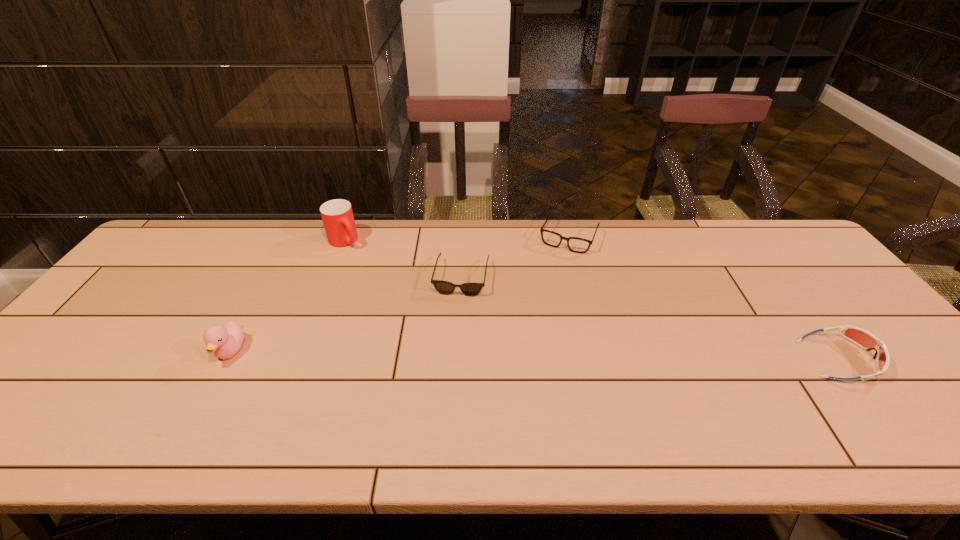
The height and width of the screenshot is (540, 960). I want to click on vacant space positioned 0.120m on the front-facing side of the spectacles, so click(x=549, y=276).

Where is `vacant space located 0.100m on the front-facing side of the spectacles`? This screenshot has width=960, height=540. vacant space located 0.100m on the front-facing side of the spectacles is located at coordinates (551, 272).

The width and height of the screenshot is (960, 540). Identify the location of vacant space located 0.360m on the front-facing side of the spectacles. (521, 332).

What are the coordinates of `vacant area located on the front lenses of the sunglasses` in the screenshot? It's located at (437, 406).

I want to click on free spot located 0.150m on the front lenses of the sunglasses, so click(x=450, y=337).

Locate an element on the screen. vacant position located on the front lenses of the sunglasses is located at coordinates (451, 328).

Where is `free space located 0.140m on the side of the tallest object with the handle`? The width and height of the screenshot is (960, 540). free space located 0.140m on the side of the tallest object with the handle is located at coordinates (373, 271).

What are the coordinates of `free space located on the side of the tallest object with the handle` in the screenshot? It's located at (408, 305).

At what (x,y) coordinates should I click in order to perform the action: click on vacant space located on the side of the tallest object with the handle. Please return your answer as a coordinate pair (x, y). The image size is (960, 540). Looking at the image, I should click on (389, 286).

This screenshot has height=540, width=960. In order to click on spectacles located in the far edge section of the desktop in this screenshot , I will do `click(577, 245)`.